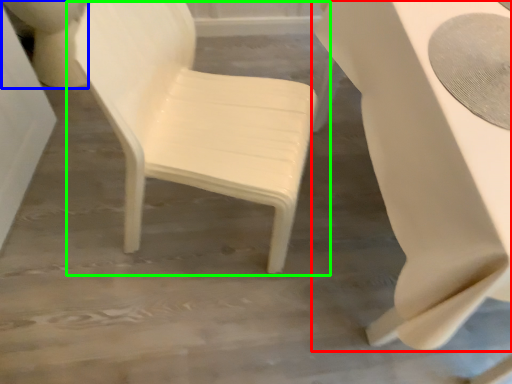
Question: Based on their relative distances, which object is farther from table (highlighted by a red box)? Choose from toilet bowl (highlighted by a blue box) and chair (highlighted by a green box).

Choices:
 (A) toilet bowl
 (B) chair

Answer: (A)